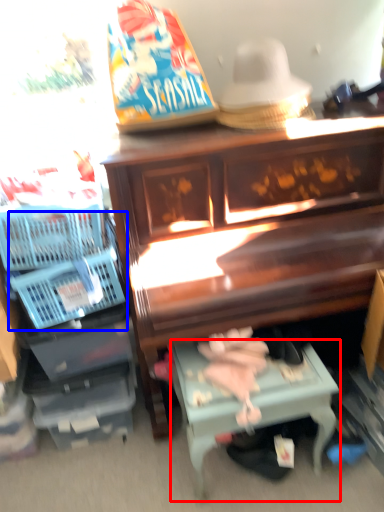
Question: Which object appears closest to the camera in this image, table (highlighted by a red box) or basket (highlighted by a blue box)?

Choices:
 (A) table
 (B) basket

Answer: (A)